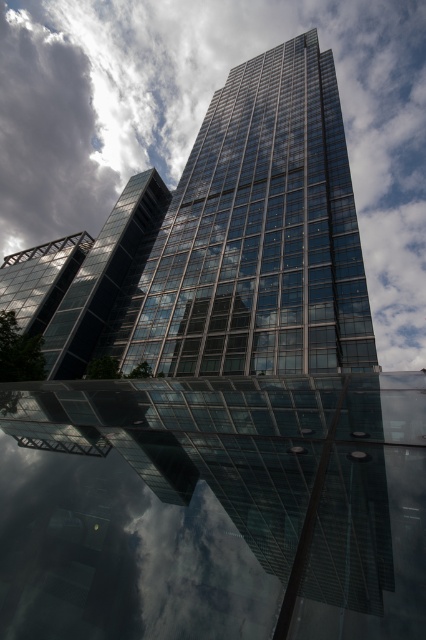
You are standing in front of the skyscraper and notice two points marked in the image. The first point is at coordinates point [141,540] and the second is at point [385,250]. Which point is closer to you?

Point [141,540] is closer to the viewer than point [385,250].

You are a drone operator planning to fly a drone between the transparent glass building at center and the white fluffy cloud at upper center. The drone has a maximum flight distance of 300 meters. Based on the scene, can the drone safely reach the cloud without exceeding its flight range?

The distance between the transparent glass building at center and the white fluffy cloud at upper center is 319.16 meters, which exceeds the drone operator maximum flight range of 300 meters. Therefore, the drone cannot safely reach the cloud without exceeding its flight range.

You are standing in front of the skyscraper and want to take a photo of the transparent glass building at center. According to the scene description, where should you position your camera to capture the reflection in the foreground? Mention the coordinates from the Objects Description.

The transparent glass building at center is located at coordinates point (210, 508). To capture its reflection in the foreground, position the camera at that coordinate point to ensure the reflection aligns with the building.